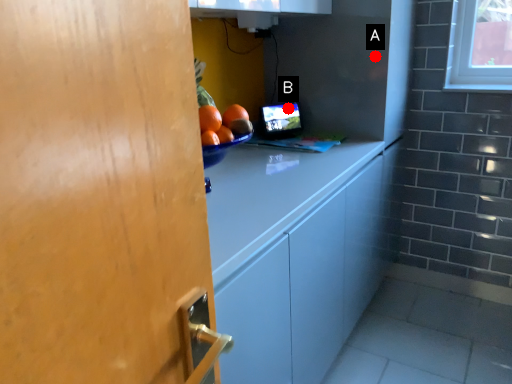
Question: Two points are circled on the image, labeled by A and B beside each circle. Among these points, which one is farthest from the camera?

Choices:
 (A) A is further
 (B) B is further

Answer: (B)